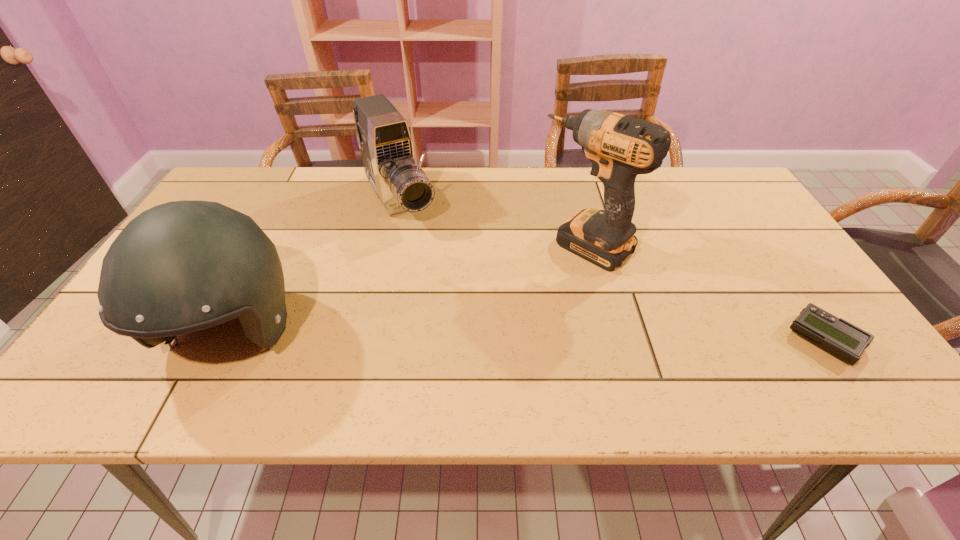
Identify the location of vacant space on the desktop that is between the football helmet and the shortest object and is positioned at the front of the second object from left to right, highlighting the lens. (484, 336).

Image resolution: width=960 pixels, height=540 pixels. Identify the location of free space on the desktop that is between the football helmet and the rightmost object and is positioned with the drill bit of the second object from right to left facing forward. (489, 336).